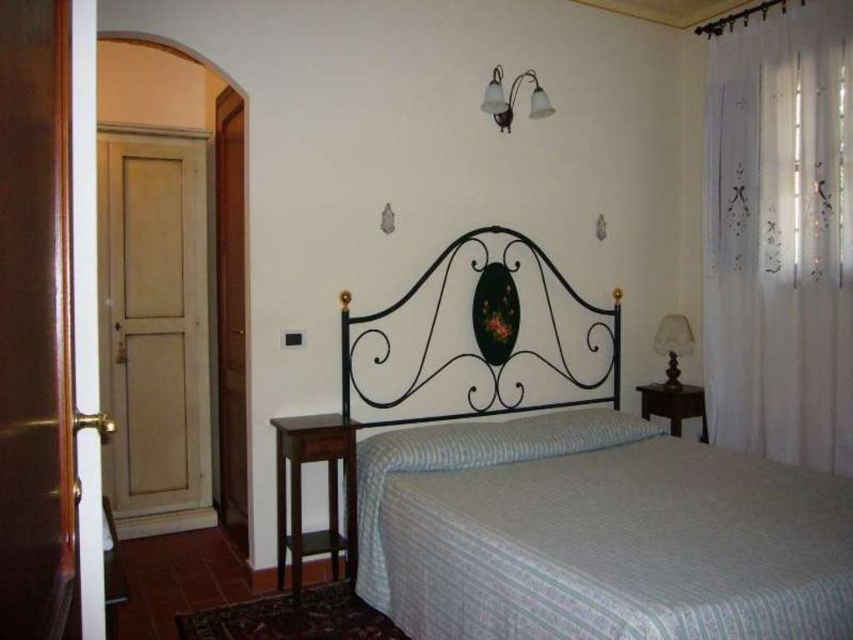
How distant is white sheer curtain at right from translucent fabric lampshade at right?

20.81 inches

Who is positioned more to the left, white sheer curtain at right or translucent fabric lampshade at right?

From the viewer's perspective, translucent fabric lampshade at right appears more on the left side.

Who is more distant from viewer, (773, 150) or (671, 388)?

Positioned behind is point (671, 388).

Identify the location of white sheer curtain at right. Image resolution: width=853 pixels, height=640 pixels. (780, 236).

Measure the distance between white sheer curtain at right and white glass wall sconce at upper center.

white sheer curtain at right is 4.48 feet away from white glass wall sconce at upper center.

Is white sheer curtain at right above white glass wall sconce at upper center?

Actually, white sheer curtain at right is below white glass wall sconce at upper center.

The image size is (853, 640). What do you see at coordinates (780, 236) in the screenshot?
I see `white sheer curtain at right` at bounding box center [780, 236].

At what (x,y) coordinates should I click in order to perform the action: click on white sheer curtain at right. Please return your answer as a coordinate pair (x, y). Looking at the image, I should click on (780, 236).

Can you confirm if white striped fabric bed at center is positioned below white sheer curtain at right?

Yes.

Is white striped fabric bed at center positioned at the back of white sheer curtain at right?

That is False.

Between point (715, 586) and point (769, 113), which one is positioned behind?

The point (769, 113) is more distant.

I want to click on white striped fabric bed at center, so click(x=566, y=483).